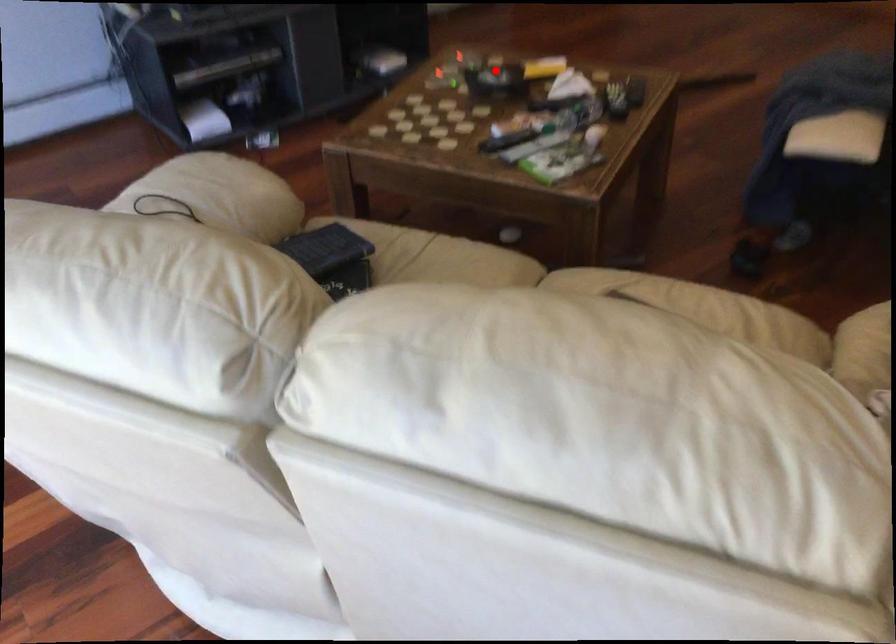
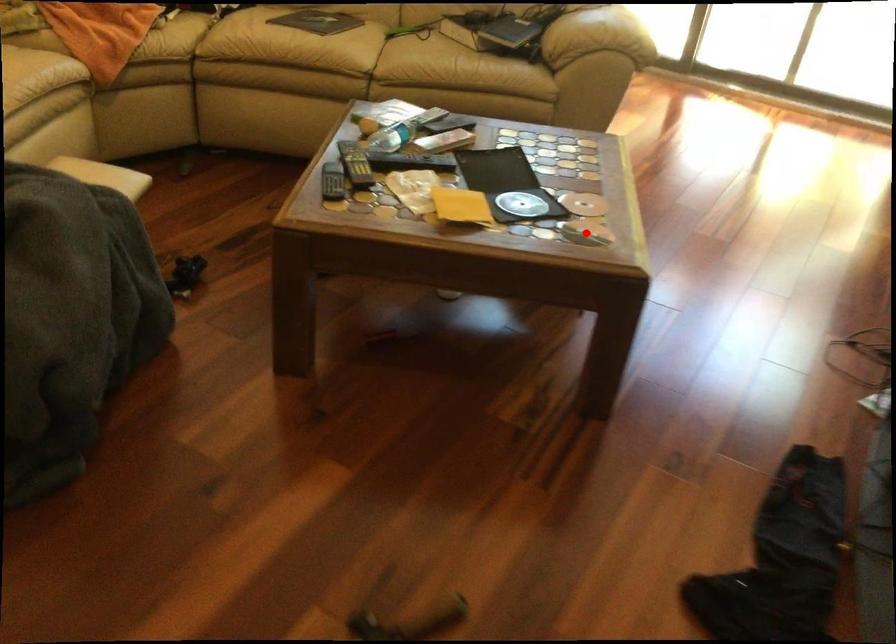
I am providing you with two images of the same scene from different viewpoints. A red point is marked on the first image and another point is marked on the second image. Do the highlighted points in image1 and image2 indicate the same real-world spot?

No